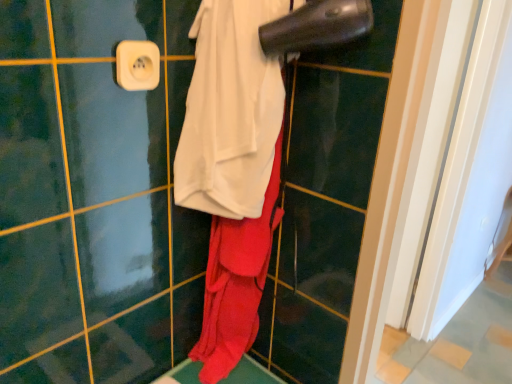
What do you see at coordinates (230, 111) in the screenshot? I see `white fabric towel at center` at bounding box center [230, 111].

Measure the distance between point (267, 86) and camera.

29.96 inches.

Locate an element on the screen. The height and width of the screenshot is (384, 512). white fabric towel at center is located at coordinates (230, 111).

Locate an element on the screen. Image resolution: width=512 pixels, height=384 pixels. white fabric towel at center is located at coordinates (230, 111).